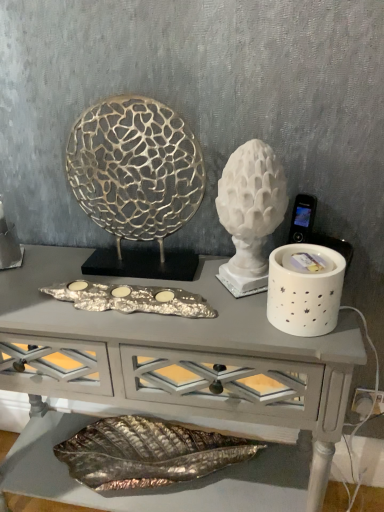
You are a GUI agent. You are given a task and a screenshot of the screen. Output one action in this format:
    pyautogui.click(x=<x>, y=<y>)
    Task: Click on the free space in front of gold textured sculpture at center, the 1th sculpture from the left
    This screenshot has height=512, width=384.
    Given the screenshot: What is the action you would take?
    pyautogui.click(x=138, y=327)